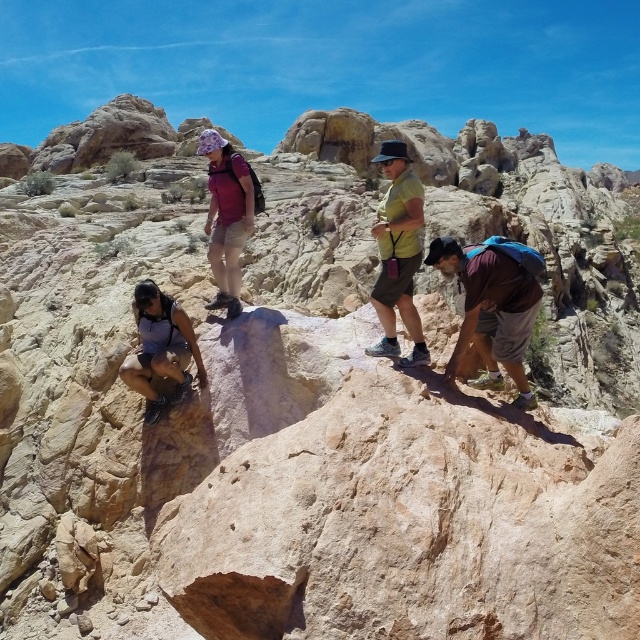
Which is more to the right, maroon fabric shirt at lower right or green matte shorts at center?

maroon fabric shirt at lower right is more to the right.

Is maroon fabric shirt at lower right thinner than green matte shorts at center?

In fact, maroon fabric shirt at lower right might be wider than green matte shorts at center.

Who is more distant from viewer, (525, 392) or (400, 236)?

The point (400, 236) is more distant.

This screenshot has width=640, height=640. I want to click on maroon fabric shirt at lower right, so click(x=493, y=305).

Does point (435, 266) lie behind point (221, 262)?

No.

Who is positioned more to the left, maroon fabric shirt at lower right or purple fabric shirt at center?

Positioned to the left is purple fabric shirt at center.

Measure the distance between point (513,328) and camera.

Point (513,328) and camera are 47.89 meters apart.

Find the location of a particular element. The width and height of the screenshot is (640, 640). maroon fabric shirt at lower right is located at coordinates (493, 305).

Can you confirm if green matte shorts at center is wider than purple fabric shirt at center?

No.

What do you see at coordinates (397, 253) in the screenshot? This screenshot has width=640, height=640. I see `green matte shorts at center` at bounding box center [397, 253].

Where is `green matte shorts at center`? This screenshot has width=640, height=640. green matte shorts at center is located at coordinates (397, 253).